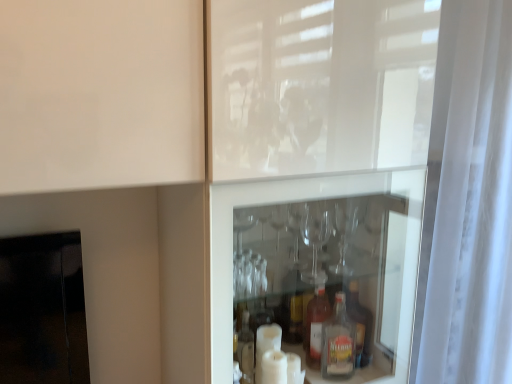
This screenshot has width=512, height=384. I want to click on white sheer curtain at right, so click(x=469, y=202).

This screenshot has height=384, width=512. What do you see at coordinates (469, 202) in the screenshot? I see `white sheer curtain at right` at bounding box center [469, 202].

You are a GUI agent. You are given a task and a screenshot of the screen. Output one action in this format:
    pyautogui.click(x=<x>, y=<y>)
    Task: Click on the white sheer curtain at right
    
    Given the screenshot: What is the action you would take?
    pyautogui.click(x=469, y=202)